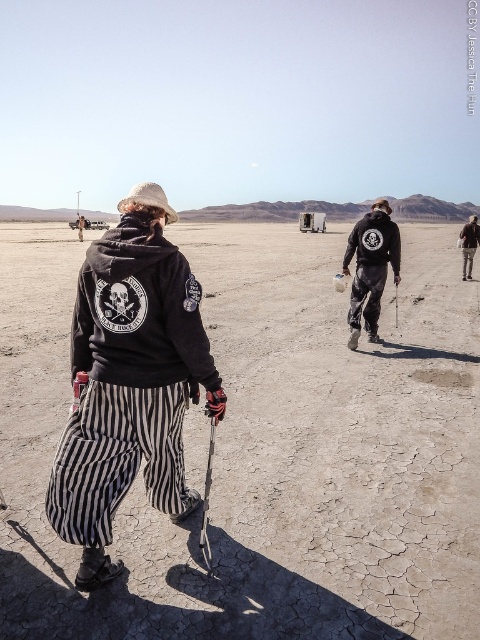
Question: Which point is closer to the camera?

Choices:
 (A) (268, 380)
 (B) (175, 253)
 (C) (154, 332)
 (D) (382, 292)

Answer: (B)

Question: From the image, what is the correct spatial relationship of black cotton hoodie at center in relation to silver metallic ski pole at center-right?

Choices:
 (A) right
 (B) left

Answer: (B)

Question: Which of the following is the closest to the observer?

Choices:
 (A) black cotton hoodie at center
 (B) silver metallic ski pole at center-right

Answer: (A)

Question: Can you confirm if black fleece sweatshirt at back is positioned below red rubber ski pole at lower center?

Choices:
 (A) yes
 (B) no

Answer: (B)

Question: Which object appears closest to the camera in this image?

Choices:
 (A) red rubber ski pole at lower center
 (B) dried mud field at center
 (C) matte black jacket at center
 (D) black fleece sweatshirt at back

Answer: (D)

Question: Can you confirm if black cotton hoodie at center is positioned below silver metallic ski pole at center-right?

Choices:
 (A) yes
 (B) no

Answer: (A)